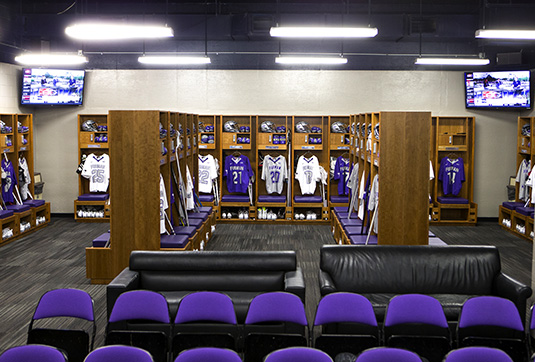
This screenshot has height=362, width=535. Find the location of `black couches`. black couches is located at coordinates (233, 263), (429, 282).